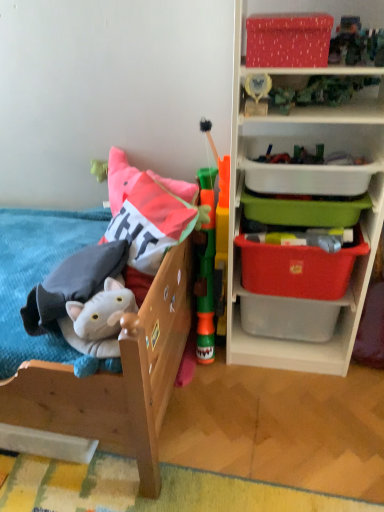
At what (x,y) coordinates should I click in order to perform the action: click on vacant space in front of green plastic tower at center, positioned as the 1th toy in right-to-left order. Please return your answer as a coordinate pair (x, y). This screenshot has height=512, width=384. Looking at the image, I should click on (223, 392).